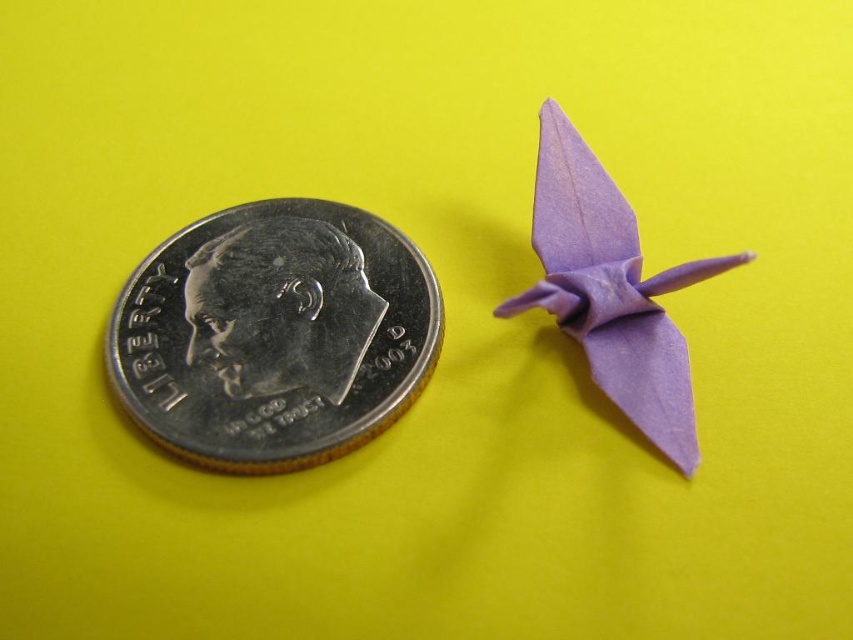
Is silver/dull metal coin at left wider than lavender paper bird at upper right?

Yes.

Find the location of a particular element. This screenshot has width=853, height=640. silver/dull metal coin at left is located at coordinates (274, 333).

Locate an element on the screen. The width and height of the screenshot is (853, 640). silver/dull metal coin at left is located at coordinates (274, 333).